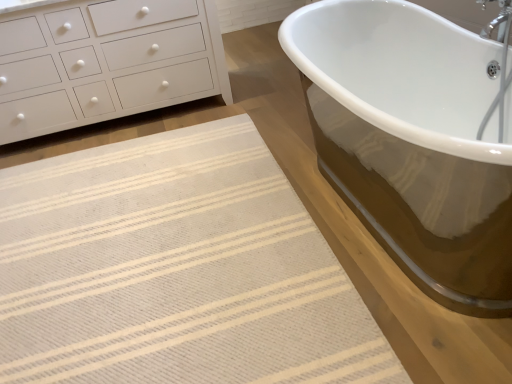
The width and height of the screenshot is (512, 384). What do you see at coordinates (105, 62) in the screenshot? I see `white matte chest of drawers at upper left` at bounding box center [105, 62].

The width and height of the screenshot is (512, 384). Find the location of `white matte chest of drawers at upper left`. white matte chest of drawers at upper left is located at coordinates (105, 62).

The width and height of the screenshot is (512, 384). In order to click on beige woven rug at lower left in this screenshot , I will do `click(175, 270)`.

Describe the element at coordinates (175, 270) in the screenshot. The height and width of the screenshot is (384, 512). I see `beige woven rug at lower left` at that location.

At what (x,y) coordinates should I click in order to perform the action: click on white matte chest of drawers at upper left. Please return your answer as a coordinate pair (x, y). Looking at the image, I should click on (105, 62).

Looking at this image, is beige woven rug at lower left at the left side of white matte chest of drawers at upper left?

No.

In the image, is beige woven rug at lower left positioned in front of or behind white matte chest of drawers at upper left?

beige woven rug at lower left is positioned closer to the viewer than white matte chest of drawers at upper left.

Is point (118, 182) behind point (39, 73)?

That is False.

From the image's perspective, relative to white matte chest of drawers at upper left, is beige woven rug at lower left above or below?

Clearly, from the image's perspective, beige woven rug at lower left is below white matte chest of drawers at upper left.

From a real-world perspective, is beige woven rug at lower left over white matte chest of drawers at upper left?

No, from a real-world perspective, beige woven rug at lower left is not over white matte chest of drawers at upper left

In terms of width, does beige woven rug at lower left look wider or thinner when compared to white matte chest of drawers at upper left?

In the image, beige woven rug at lower left appears to be wider than white matte chest of drawers at upper left.

Considering the relative sizes of beige woven rug at lower left and white matte chest of drawers at upper left in the image provided, is beige woven rug at lower left taller than white matte chest of drawers at upper left?

In fact, beige woven rug at lower left may be shorter than white matte chest of drawers at upper left.

Based on their sizes in the image, would you say beige woven rug at lower left is bigger or smaller than white matte chest of drawers at upper left?

Considering their sizes, beige woven rug at lower left takes up less space than white matte chest of drawers at upper left.

Looking at this image, is beige woven rug at lower left inside or outside of white matte chest of drawers at upper left?

beige woven rug at lower left is located beyond the bounds of white matte chest of drawers at upper left.

Would you consider beige woven rug at lower left to be distant from white matte chest of drawers at upper left?

Yes, beige woven rug at lower left and white matte chest of drawers at upper left are quite far apart.

Is beige woven rug at lower left oriented away from white matte chest of drawers at upper left?

Correct, beige woven rug at lower left is looking away from white matte chest of drawers at upper left.

In the scene shown: What's the angular difference between beige woven rug at lower left and white matte chest of drawers at upper left's facing directions?

beige woven rug at lower left and white matte chest of drawers at upper left are facing 1.24 degrees away from each other.

Find the location of a particular element. bath mat that appears in front of the white matte chest of drawers at upper left is located at coordinates (175, 270).

Is white matte chest of drawers at upper left to the left or to the right of beige woven rug at lower left in the image?

white matte chest of drawers at upper left is positioned on beige woven rug at lower left's left side.

Which object is further away from the camera taking this photo, white matte chest of drawers at upper left or beige woven rug at lower left?

white matte chest of drawers at upper left is more distant.

Does point (113, 23) appear closer or farther from the camera than point (13, 212)?

Point (113, 23).

From the image's perspective, which object appears higher, white matte chest of drawers at upper left or beige woven rug at lower left?

From the image's view, white matte chest of drawers at upper left is above.

From a real-world perspective, relative to beige woven rug at lower left, is white matte chest of drawers at upper left vertically above or below?

In terms of real-world spatial position, white matte chest of drawers at upper left is above beige woven rug at lower left.

Looking at their sizes, would you say white matte chest of drawers at upper left is wider or thinner than beige woven rug at lower left?

white matte chest of drawers at upper left is thinner than beige woven rug at lower left.

Is white matte chest of drawers at upper left taller or shorter than beige woven rug at lower left?

white matte chest of drawers at upper left is taller than beige woven rug at lower left.

Between white matte chest of drawers at upper left and beige woven rug at lower left, which one has smaller size?

With smaller size is beige woven rug at lower left.

Is white matte chest of drawers at upper left located outside beige woven rug at lower left?

Yes, white matte chest of drawers at upper left is outside of beige woven rug at lower left.

Are white matte chest of drawers at upper left and beige woven rug at lower left far apart?

white matte chest of drawers at upper left is far away from beige woven rug at lower left.

Is white matte chest of drawers at upper left positioned with its back to beige woven rug at lower left?

white matte chest of drawers at upper left does not have its back to beige woven rug at lower left.

Looking at this image, measure the distance from white matte chest of drawers at upper left to beige woven rug at lower left.

white matte chest of drawers at upper left is 3.60 feet away from beige woven rug at lower left.

Where is `chest of drawers on the left of beige woven rug at lower left`? chest of drawers on the left of beige woven rug at lower left is located at coordinates (105, 62).

Where is `bath mat that appears below the white matte chest of drawers at upper left (from the image's perspective)`? This screenshot has height=384, width=512. bath mat that appears below the white matte chest of drawers at upper left (from the image's perspective) is located at coordinates (175, 270).

Image resolution: width=512 pixels, height=384 pixels. Identify the location of the chest of drawers that is above the beige woven rug at lower left (from the image's perspective). (105, 62).